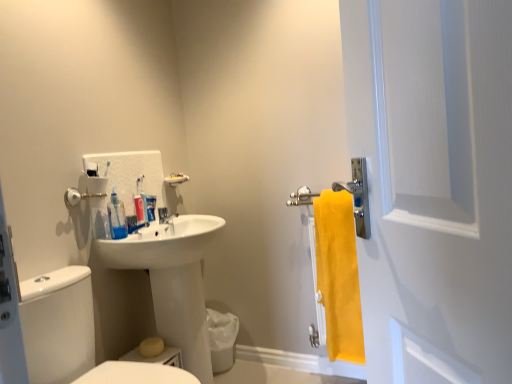
Find the location of a particular element. Image resolution: width=512 pixels, height=384 pixels. vacant point to the right of white matte toothpaste at center is located at coordinates (183, 219).